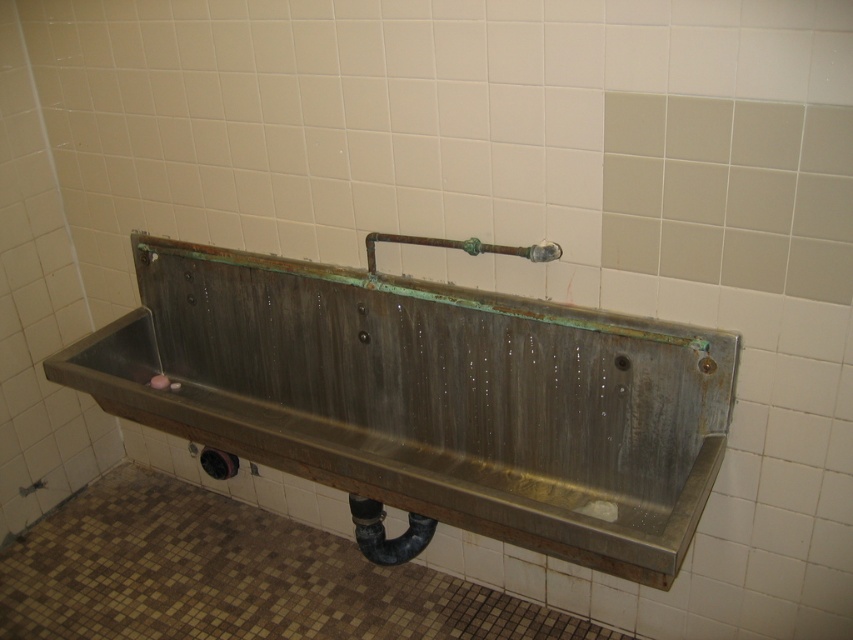
Does stainless steel sink at center appear on the right side of green patina faucet at center?

In fact, stainless steel sink at center is to the left of green patina faucet at center.

Where is `stainless steel sink at center`? stainless steel sink at center is located at coordinates (427, 401).

Identify the location of stainless steel sink at center. (427, 401).